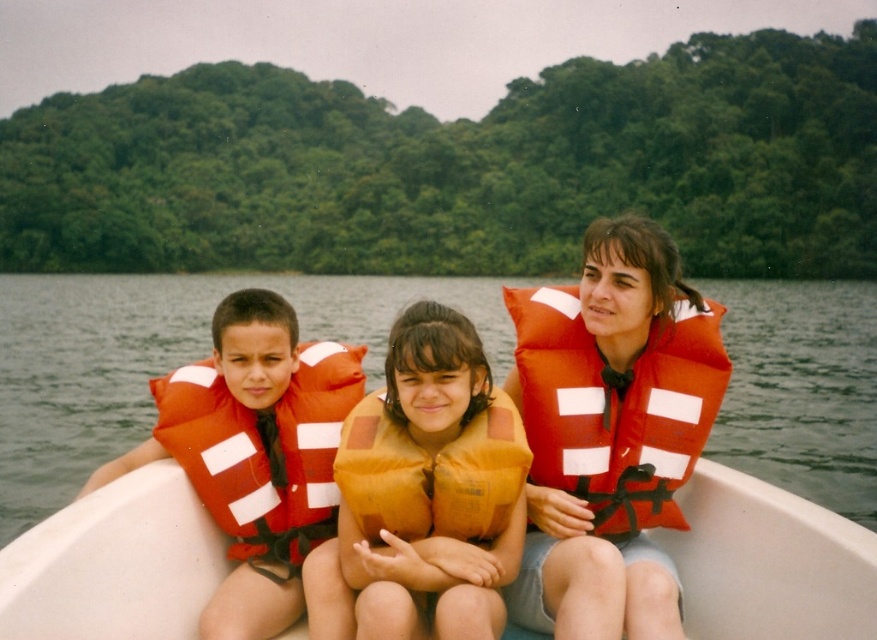
Is orange soft life vest at center positioned in front of orange fabric life jacket at center?

Yes, it is.

Does orange soft life vest at center appear on the right side of orange fabric life jacket at center?

No, orange soft life vest at center is not to the right of orange fabric life jacket at center.

Between point (403, 540) and point (653, 524), which one is positioned in front?

Point (403, 540)

Find the location of a particular element. orange soft life vest at center is located at coordinates tap(421, 496).

Who is more distant from viewer, (854, 326) or (671, 355)?

The point (854, 326) is behind.

Does matte orange life vest at center appear on the right side of orange fabric life jacket at center?

In fact, matte orange life vest at center is to the left of orange fabric life jacket at center.

The width and height of the screenshot is (877, 640). I want to click on matte orange life vest at center, so click(x=162, y=356).

Does matte orange life vest at left appear under orange fabric life vest at center?

Yes, matte orange life vest at left is below orange fabric life vest at center.

From the picture: Is matte orange life vest at left bigger than orange fabric life vest at center?

Correct, matte orange life vest at left is larger in size than orange fabric life vest at center.

Describe the element at coordinates (255, 452) in the screenshot. Image resolution: width=877 pixels, height=640 pixels. I see `matte orange life vest at left` at that location.

This screenshot has width=877, height=640. I want to click on matte orange life vest at left, so click(x=255, y=452).